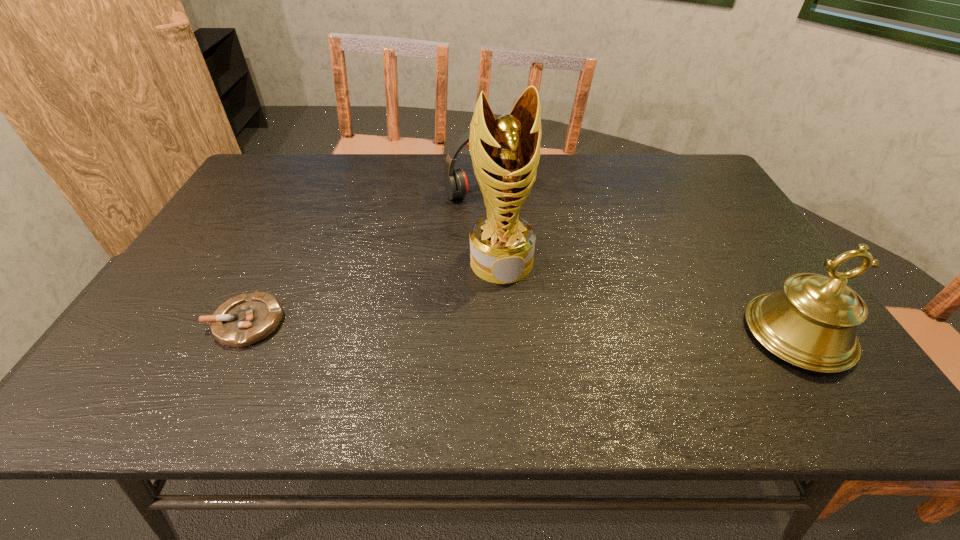
What are the coordinates of `free space on the desktop that is between the shortest object and the rightmost object and is positioned on the ear cups of the third tallest object` in the screenshot? It's located at (589, 329).

At what (x,y) coordinates should I click in order to perform the action: click on free space on the desktop that is between the ashtray and the bell and is positioned on the front-facing side of the second farthest object. Please return your answer as a coordinate pair (x, y). The height and width of the screenshot is (540, 960). Looking at the image, I should click on tap(522, 328).